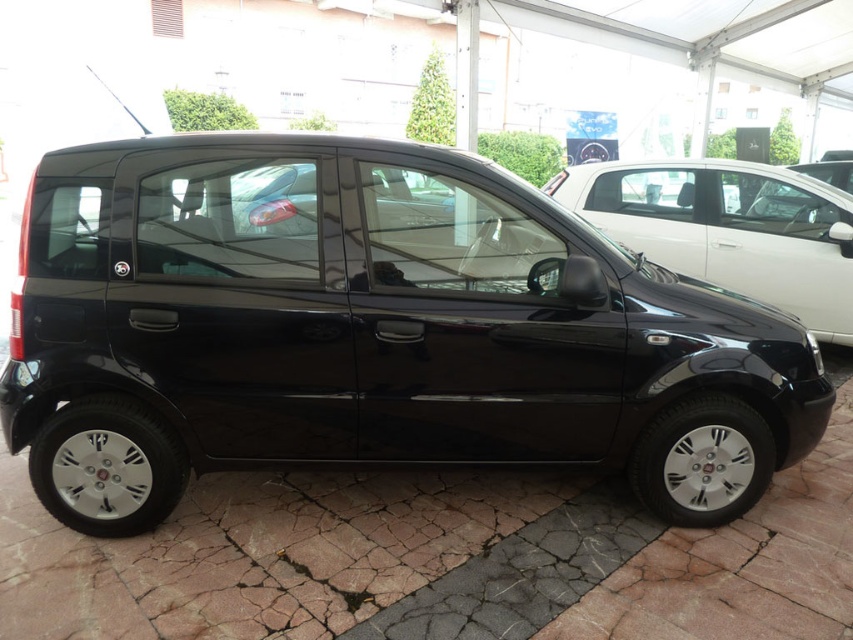
Is glossy black minivan at center positioned before glossy black car at center?

That is True.

Between glossy black minivan at center and glossy black car at center, which one has less height?

glossy black car at center

This screenshot has height=640, width=853. Find the location of `glossy black minivan at center`. glossy black minivan at center is located at coordinates [370, 330].